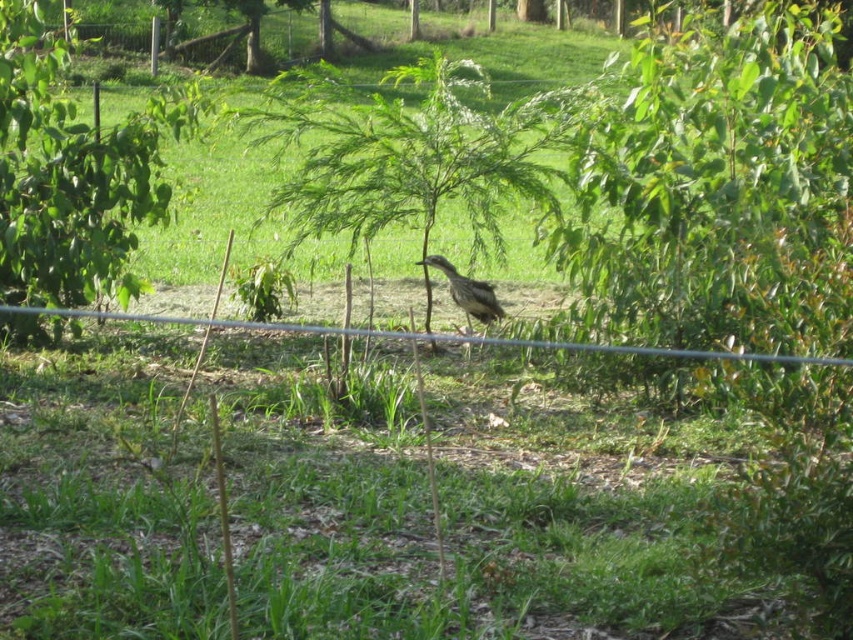
Question: Is green leafy tree at left smaller than brown feathered bird at center?

Choices:
 (A) yes
 (B) no

Answer: (B)

Question: Is green leafy tree at center to the left of brown feathered bird at center from the viewer's perspective?

Choices:
 (A) no
 (B) yes

Answer: (B)

Question: Can you confirm if green leafy tree at left is wider than brown feathered bird at center?

Choices:
 (A) yes
 (B) no

Answer: (A)

Question: Considering the real-world distances, which object is closest to the green leafy tree at center?

Choices:
 (A) green leafy tree at left
 (B) brown feathered bird at center

Answer: (A)

Question: Which is farther from the brown feathered bird at center?

Choices:
 (A) green leafy tree at center
 (B) green leafy tree at left

Answer: (A)

Question: Which point appears farthest from the camera in this image?

Choices:
 (A) (489, 186)
 (B) (488, 301)

Answer: (A)